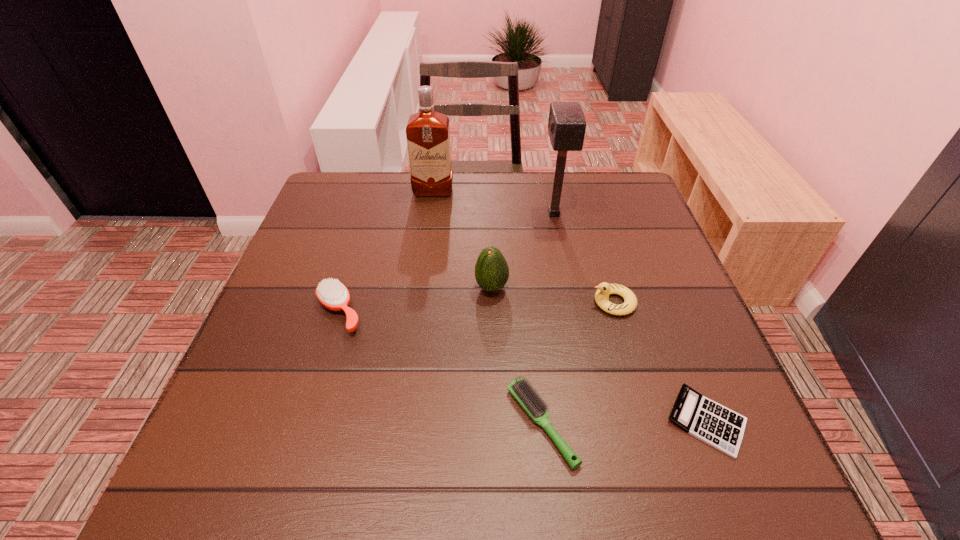
Where is `calculator`? The height and width of the screenshot is (540, 960). calculator is located at coordinates (716, 425).

Find the location of `vacant space located 0.060m on the front label of the second object from left to right`. vacant space located 0.060m on the front label of the second object from left to right is located at coordinates (431, 211).

The height and width of the screenshot is (540, 960). Identify the location of free region located on the right of the second farthest object. (612, 214).

Where is `vacant position located 0.300m on the right of the third tallest object`? The width and height of the screenshot is (960, 540). vacant position located 0.300m on the right of the third tallest object is located at coordinates (642, 288).

The image size is (960, 540). In order to click on free region located on the face of the fourth tallest object in this screenshot , I will do `click(535, 302)`.

You are a GUI agent. You are given a task and a screenshot of the screen. Output one action in this format:
    pyautogui.click(x=<x>, y=<y>)
    Task: Click on the vacant space located 0.120m on the face of the fourth tallest object
    Image resolution: width=960 pixels, height=540 pixels.
    Given the screenshot: What is the action you would take?
    pyautogui.click(x=535, y=302)

The image size is (960, 540). Identify the location of vacant area located 0.400m on the face of the fourth tallest object. (406, 302).

The width and height of the screenshot is (960, 540). I want to click on free space located on the back of the left hairbrush, so click(355, 259).

You are a GUI agent. You are given a task and a screenshot of the screen. Output one action in this format:
    pyautogui.click(x=<x>, y=<y>)
    Task: Click on the free space located on the left of the nearer hairbrush
    
    Given the screenshot: What is the action you would take?
    pyautogui.click(x=421, y=424)

The width and height of the screenshot is (960, 540). Find the location of `free location located 0.270m on the left of the shortest object`. free location located 0.270m on the left of the shortest object is located at coordinates (509, 421).